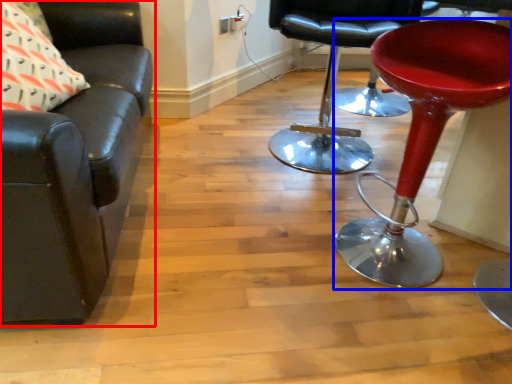
Question: Which object is closer to the camera taking this photo, chair (highlighted by a red box) or stool (highlighted by a blue box)?

Choices:
 (A) chair
 (B) stool

Answer: (A)